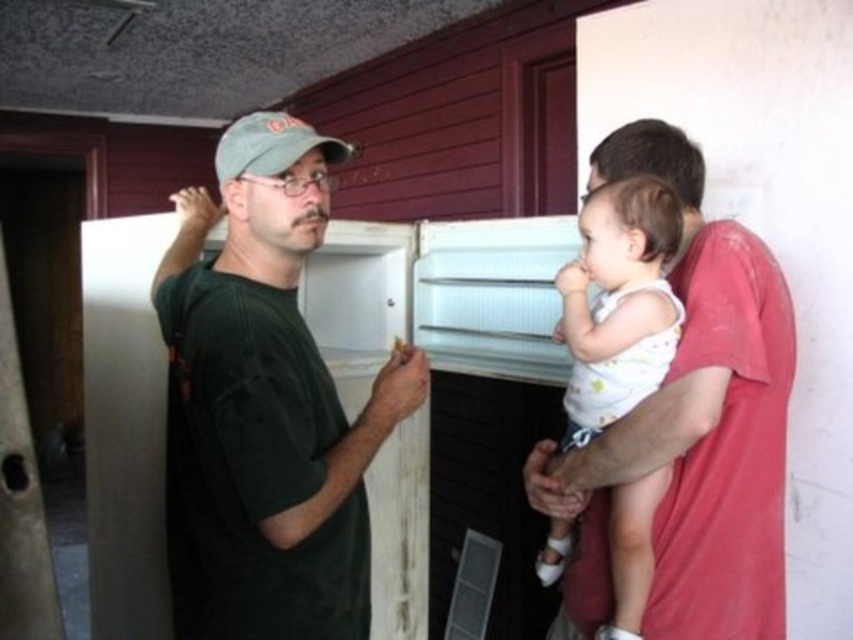
You are organizing a small item storage area and need to know which object is wider between the white cotton baby at center and the green fabric baseball cap at upper center. Could you determine which one is wider?

The white cotton baby at center is wider than the green fabric baseball cap at upper center according to the description.

You are standing in the kitchen scene and want to know which of the two points, point (648, 188) or point (276, 152), is closer to you. Can you determine this based on their positions?

Point (276, 152) is closer to you because it is less further to the camera than point (648, 188).

You are a photographer setting up a shoot in this kitchen scene. You need to ensure that the matte red shirt at right and the white cotton baby at center are both visible in the frame. Given their sizes, which object might require more careful positioning to avoid being overshadowed?

The white cotton baby at center is smaller in size than the matte red shirt at right, so it might require more careful positioning to ensure it remains visible in the frame.